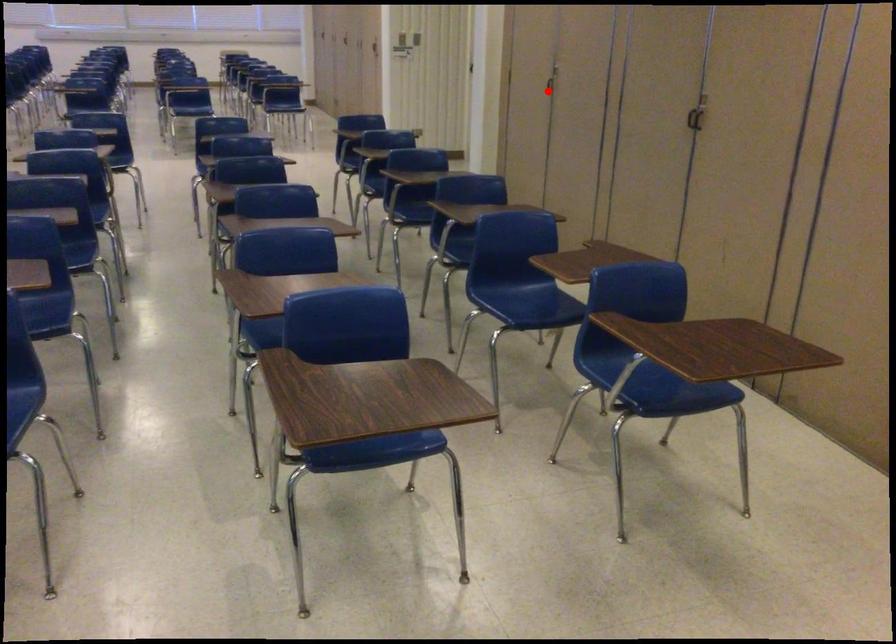
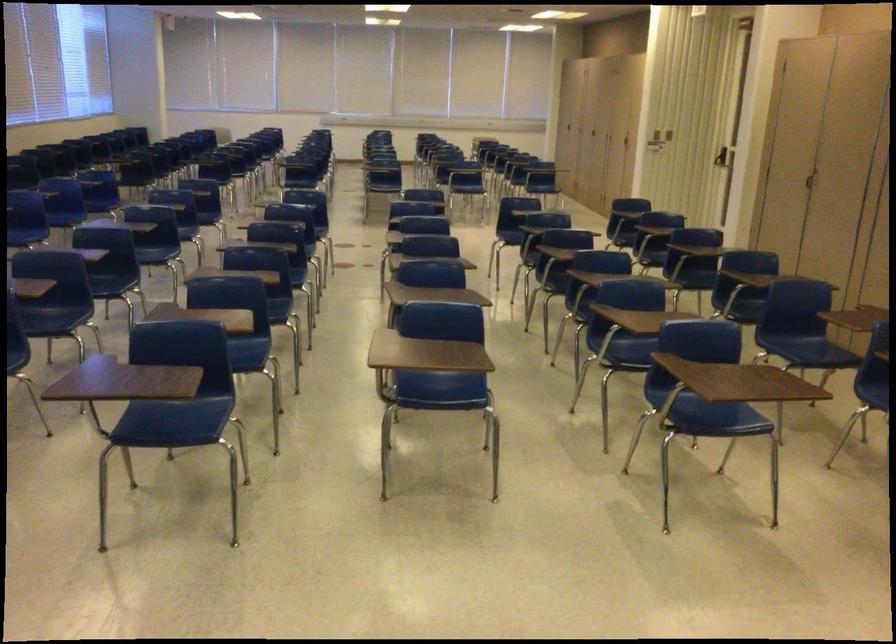
Find the pixel in the second image that matches the highlighted location in the first image.

(808, 180)